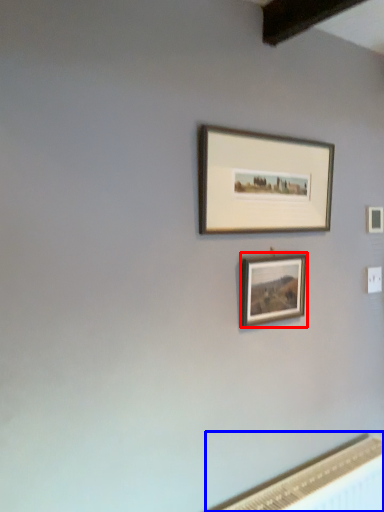
Question: Among these objects, which one is nearest to the camera, picture frame (highlighted by a red box) or radiator (highlighted by a blue box)?

Choices:
 (A) picture frame
 (B) radiator

Answer: (B)